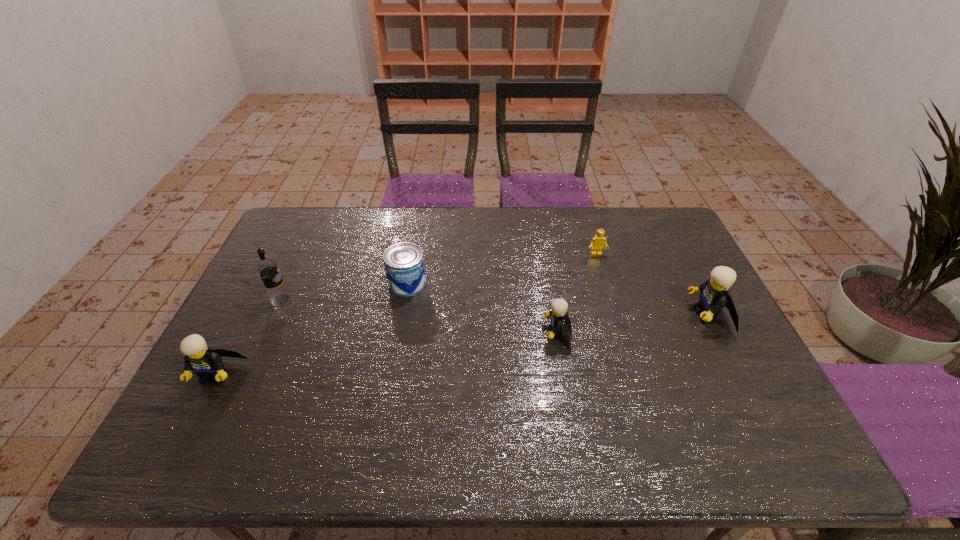
Where is `free space located 0.070m on the front-facing side of the third tallest Lego`? free space located 0.070m on the front-facing side of the third tallest Lego is located at coordinates (517, 333).

What are the coordinates of `vacant region located on the front-facing side of the third tallest Lego` in the screenshot? It's located at (459, 333).

The width and height of the screenshot is (960, 540). Find the location of `free space located on the front-facing side of the rightmost Lego`. free space located on the front-facing side of the rightmost Lego is located at coordinates (672, 315).

Find the location of `vacant space located on the front-facing side of the rightmost Lego`. vacant space located on the front-facing side of the rightmost Lego is located at coordinates (555, 315).

The width and height of the screenshot is (960, 540). Identify the location of vacant region located 0.400m on the front-facing side of the rightmost Lego. (548, 315).

Identify the location of free space located on the face of the second object from right to left. The width and height of the screenshot is (960, 540). (601, 269).

At what (x,y) coordinates should I click in order to perform the action: click on vacant space located 0.370m on the label of the vodka. Please return your answer as a coordinate pair (x, y). The height and width of the screenshot is (540, 960). Looking at the image, I should click on (418, 300).

I want to click on free space located 0.170m on the front label of the fourth object from right to left, so click(x=397, y=342).

The width and height of the screenshot is (960, 540). Identify the location of object that is at the near edge. tap(206, 362).

The height and width of the screenshot is (540, 960). What are the coordinates of `Lego that is at the left edge` in the screenshot? It's located at (206, 362).